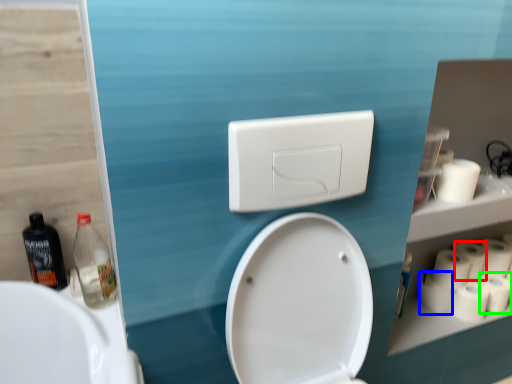
Question: Based on their relative distances, which object is nearer to toilet paper (highlighted by a red box)? Choose from toilet paper (highlighted by a blue box) and toilet paper (highlighted by a green box).

Choices:
 (A) toilet paper
 (B) toilet paper

Answer: (B)